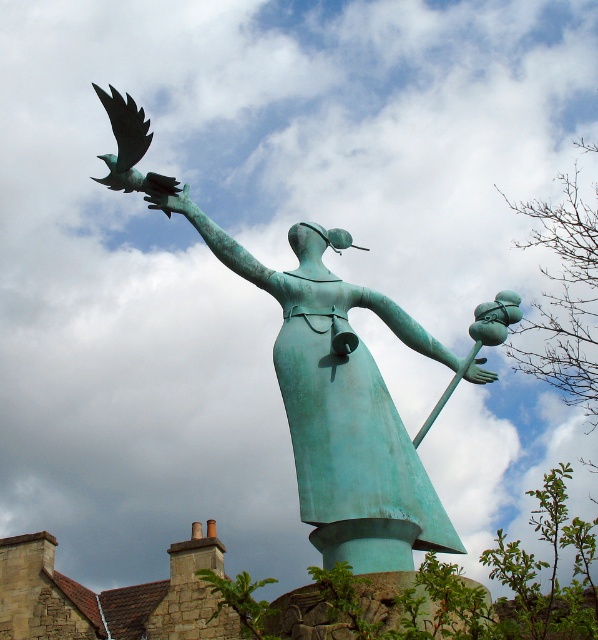
Question: Which of the following is the closest to the observer?

Choices:
 (A) green patina bird at upper left
 (B) green patina statue at center

Answer: (B)

Question: Can you confirm if green patina statue at center is smaller than green patina bird at upper left?

Choices:
 (A) yes
 (B) no

Answer: (A)

Question: Is green patina statue at center behind green patina bird at upper left?

Choices:
 (A) yes
 (B) no

Answer: (B)

Question: Observing the image, what is the correct spatial positioning of green patina statue at center in reference to green patina bird at upper left?

Choices:
 (A) right
 (B) left

Answer: (A)